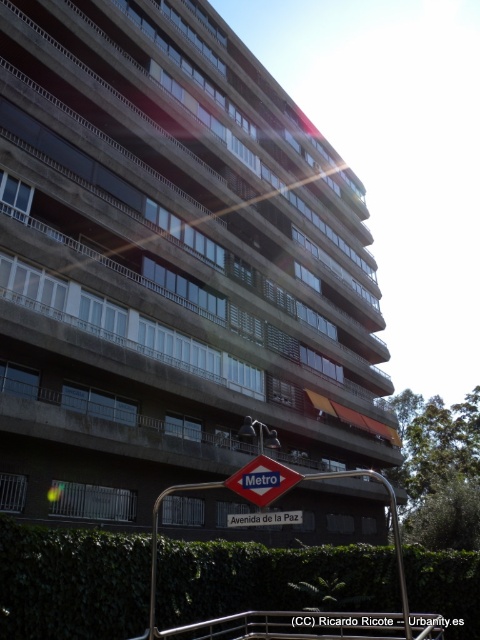
Question: Which of the following is the closest to the observer?

Choices:
 (A) metallic diamond-shaped sign at lower center
 (B) green leafy hedge at lower center

Answer: (A)

Question: Among these objects, which one is nearest to the camera?

Choices:
 (A) metallic diamond-shaped sign at lower center
 (B) green leafy hedge at lower center

Answer: (A)

Question: Is green leafy hedge at lower center closer to camera compared to metallic diamond-shaped sign at lower center?

Choices:
 (A) no
 (B) yes

Answer: (A)

Question: From the image, what is the correct spatial relationship of green leafy hedge at lower center in relation to metallic diamond-shaped sign at lower center?

Choices:
 (A) above
 (B) below

Answer: (B)

Question: Can you confirm if green leafy hedge at lower center is positioned above metallic diamond-shaped sign at lower center?

Choices:
 (A) yes
 (B) no

Answer: (B)

Question: Which object is closer to the camera taking this photo?

Choices:
 (A) metallic diamond-shaped sign at lower center
 (B) green leafy hedge at lower center

Answer: (A)